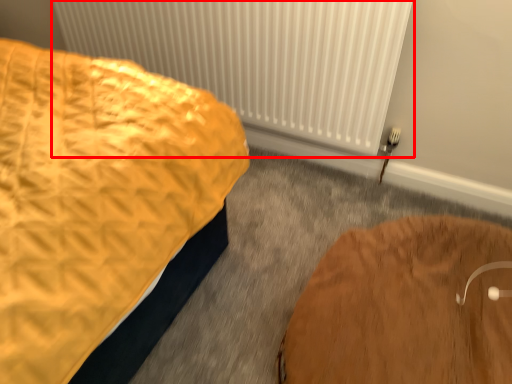
Question: From the image's perspective, where is radiator (annotated by the red box) located in relation to furniture in the image?

Choices:
 (A) above
 (B) below

Answer: (A)